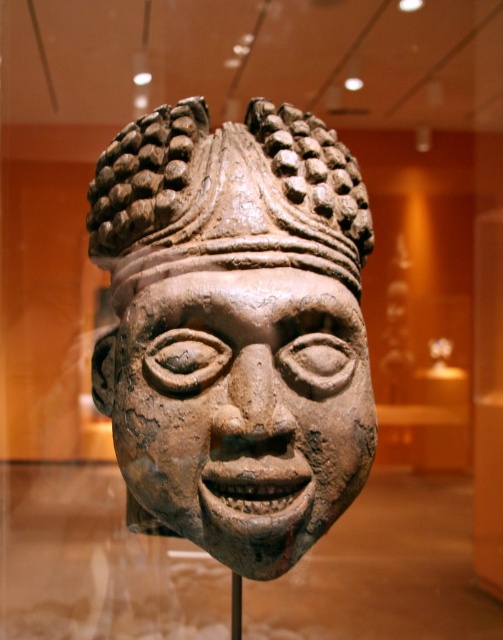
Is brown clay mask at center above earthy clay headdress at center?

No, brown clay mask at center is not above earthy clay headdress at center.

Can you confirm if brown clay mask at center is shorter than earthy clay headdress at center?

No, brown clay mask at center is not shorter than earthy clay headdress at center.

Find the location of a particular element. The height and width of the screenshot is (640, 503). brown clay mask at center is located at coordinates (241, 410).